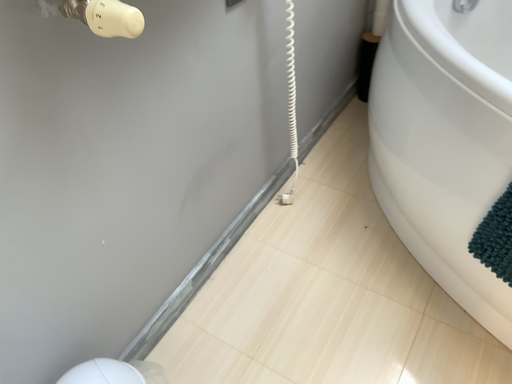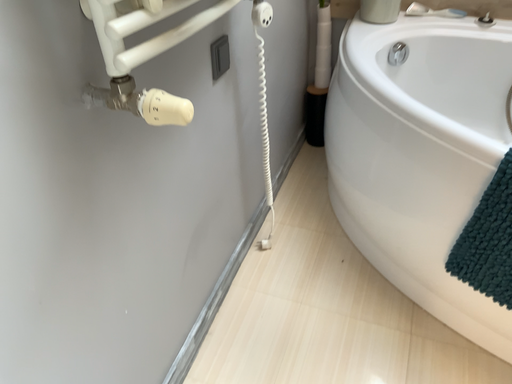
Question: How did the camera likely rotate when shooting the video?

Choices:
 (A) rotated right
 (B) rotated left

Answer: (A)